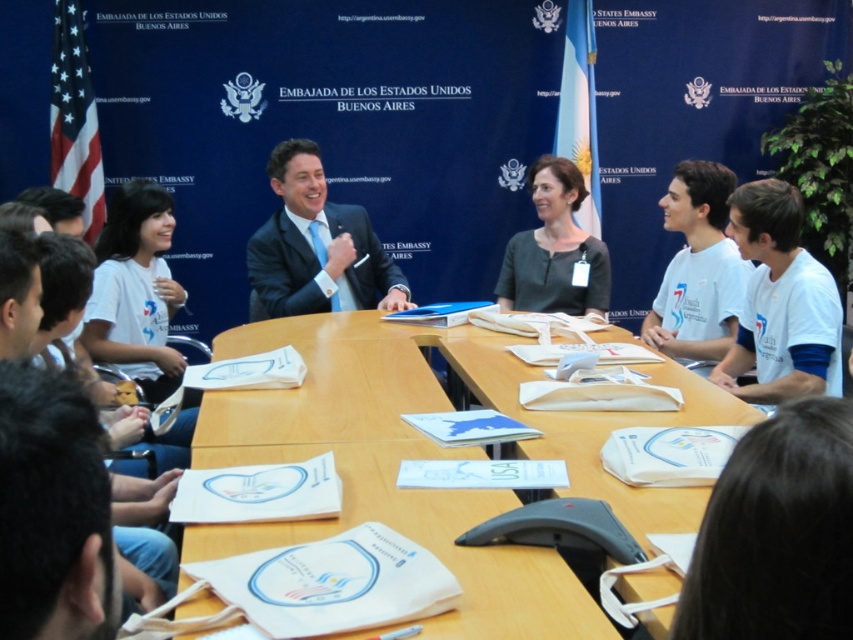
Can you confirm if wooden table at center is positioned to the left of white fabric bag at lower center?

In fact, wooden table at center is to the right of white fabric bag at lower center.

Is wooden table at center thinner than white fabric bag at lower center?

In fact, wooden table at center might be wider than white fabric bag at lower center.

Locate an element on the screen. wooden table at center is located at coordinates (434, 458).

Locate an element on the screen. The image size is (853, 640). wooden table at center is located at coordinates (434, 458).

Is point (113, 560) less distant than point (262, 280)?

Yes, point (113, 560) is in front of point (262, 280).

Which is more to the right, dark brown hair at lower left or shiny blue suit at center?

dark brown hair at lower left

Is point (108, 515) positioned before point (374, 264)?

Yes, it is in front of point (374, 264).

The width and height of the screenshot is (853, 640). Identify the location of dark brown hair at lower left. (53, 512).

Can you confirm if white fabric bag at lower center is wider than dark brown hair at lower left?

Answer: Indeed, white fabric bag at lower center has a greater width compared to dark brown hair at lower left.

This screenshot has width=853, height=640. Identify the location of white fabric bag at lower center. (x=421, y=540).

Where is `white fabric bag at lower center`? The image size is (853, 640). white fabric bag at lower center is located at coordinates (421, 540).